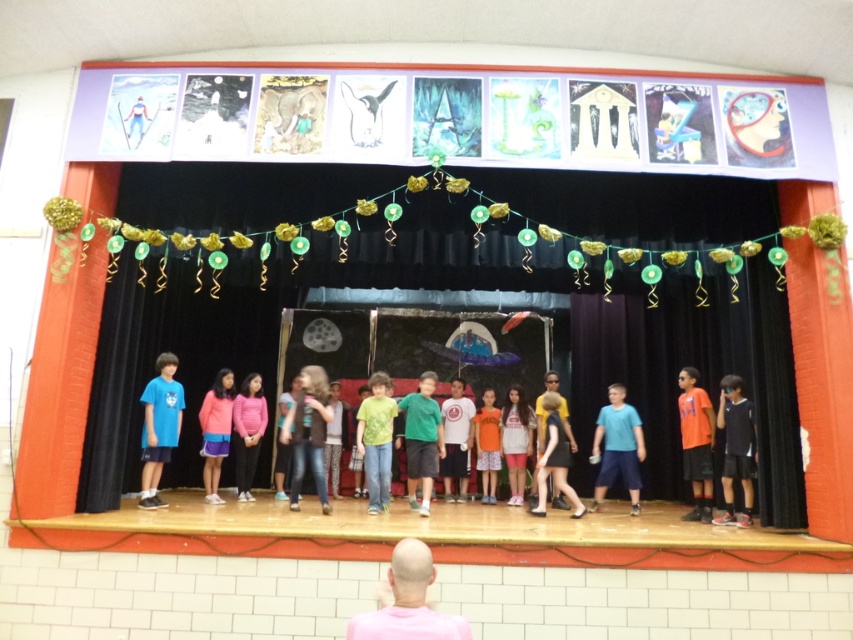
Is pink matte sweater at center smaller than light brown fabric dress at center?

Correct, pink matte sweater at center occupies less space than light brown fabric dress at center.

Looking at this image, who is more distant from viewer, (239, 413) or (558, 488)?

The point (239, 413) is behind.

Is point (245, 442) in front of point (558, 417)?

No, (245, 442) is behind (558, 417).

Where is `pink matte sweater at center`? Image resolution: width=853 pixels, height=640 pixels. pink matte sweater at center is located at coordinates (248, 432).

Which of these two, orange cotton shirt at right or green matte shirt at center, stands shorter?

green matte shirt at center is shorter.

Is orange cotton shirt at right below green matte shirt at center?

No, orange cotton shirt at right is not below green matte shirt at center.

Where is `orange cotton shirt at right`? orange cotton shirt at right is located at coordinates (695, 442).

Which of these two, pink matte shirt at lower center or jeans at center, stands shorter?

Standing shorter between the two is pink matte shirt at lower center.

The width and height of the screenshot is (853, 640). Identify the location of pink matte shirt at lower center. (408, 602).